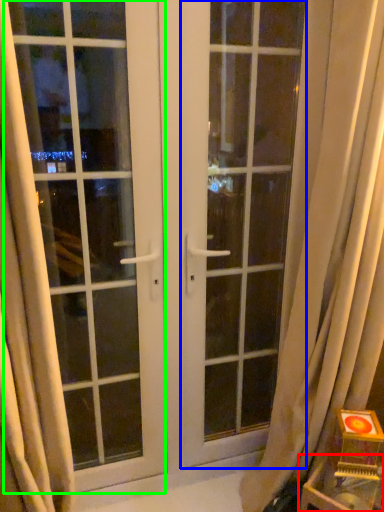
Question: Estimate the real-world distances between objects in this image. Which object is closer to furniture (highlighted by a red box), screen door (highlighted by a blue box) or window (highlighted by a green box)?

Choices:
 (A) screen door
 (B) window

Answer: (A)